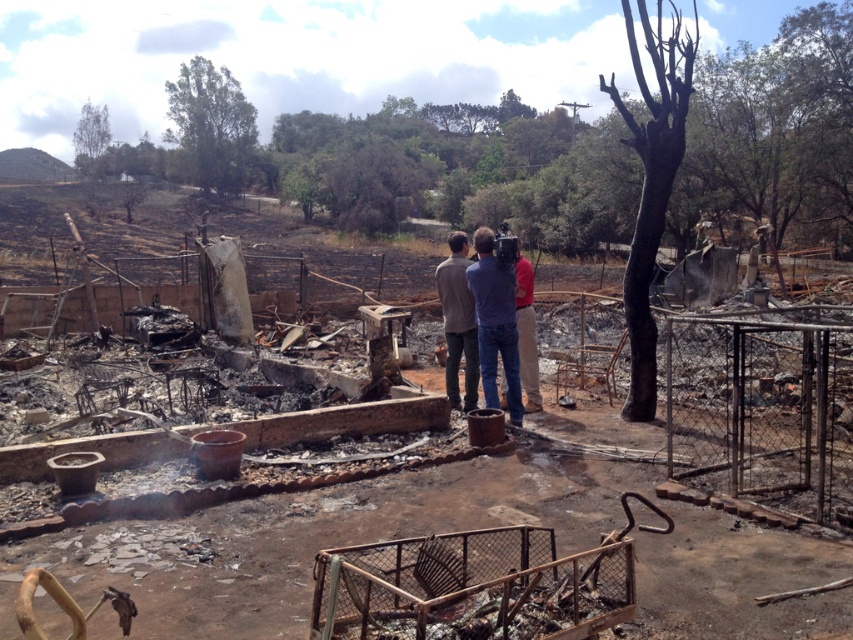
You are a firefighter assessing the damage after a fire. You notice the charcoal ash debris at center and the matte gray jacket at center. Which object is taller?

The matte gray jacket at center is taller than the charcoal ash debris at center.